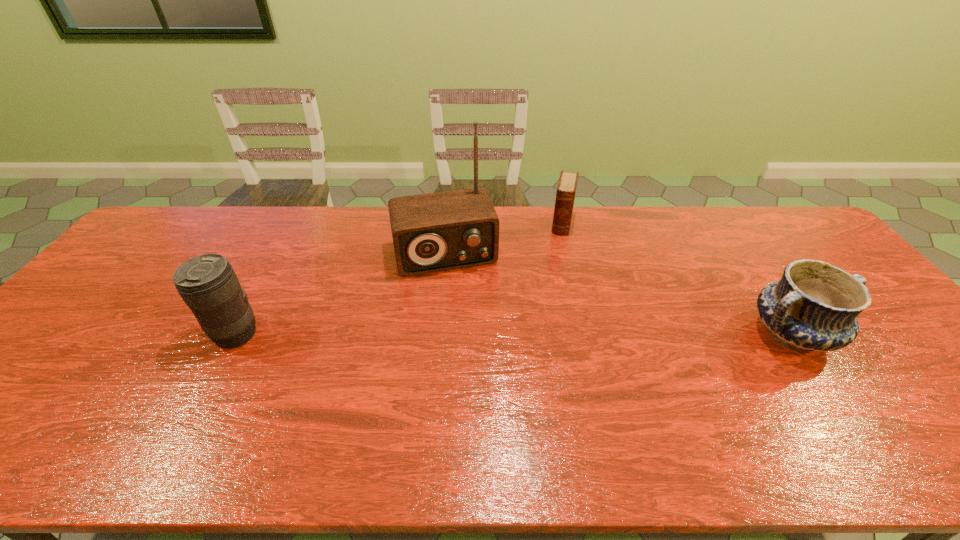
Identify the location of free space between the third object from right to left and the third object from left to right. (504, 238).

At what (x,y) coordinates should I click in order to perform the action: click on empty location between the second tallest object and the second object from right to left. Please return your answer as a coordinate pair (x, y). Looking at the image, I should click on (398, 279).

This screenshot has width=960, height=540. I want to click on vacant area that lies between the third shortest object and the second object from left to right, so click(x=340, y=294).

Image resolution: width=960 pixels, height=540 pixels. Identify the location of unoccupied position between the leftmost object and the rightmost object. (514, 334).

Find the location of `empty space that is in between the third object from left to right and the radio receiver`. empty space that is in between the third object from left to right and the radio receiver is located at coordinates (504, 238).

Locate which object is the second closest to the third object from left to right. Please provide its 2D coordinates. Your answer should be formatted as a tuple, i.e. [(x, y)], where the tuple contains the x and y coordinates of a point satisfying the conditions above.

[(815, 305)]

Where is `object that ranks as the second closest to the pottery`? This screenshot has height=540, width=960. object that ranks as the second closest to the pottery is located at coordinates 433,232.

Identify the location of vacant position in the image that satisfies the following two spatial constraints: 1. on the front side of the third object from left to right; 2. on the left side of the pottery. (588, 334).